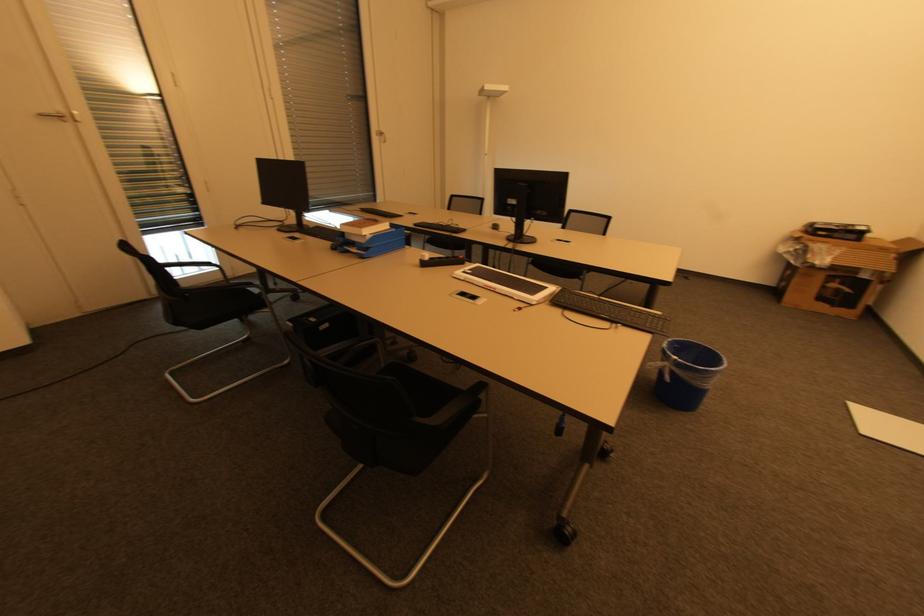
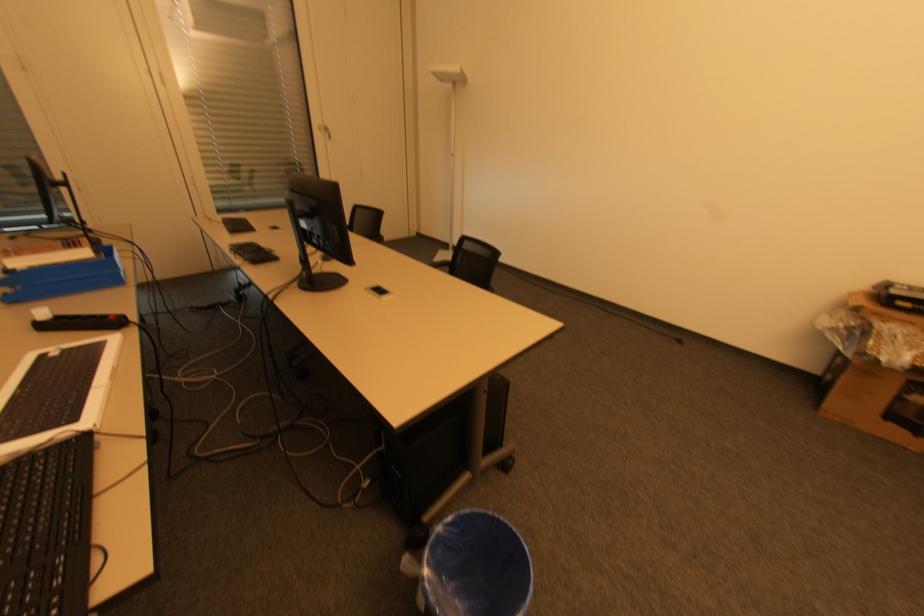
The images are taken continuously from a first-person perspective. In which direction are you moving?

The cameraman walked toward right, forward.